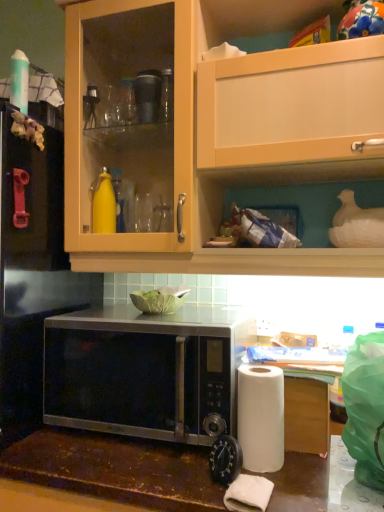
Find the location of a particular element. The width and height of the screenshot is (384, 512). white matte paper towel at lower right is located at coordinates (261, 417).

The width and height of the screenshot is (384, 512). What do you see at coordinates (144, 372) in the screenshot?
I see `black metallic microwave at center` at bounding box center [144, 372].

Where is `matte wood cabinet at upper center`? The width and height of the screenshot is (384, 512). matte wood cabinet at upper center is located at coordinates (217, 129).

Locate an element on the screen. This screenshot has height=512, width=384. white matte paper towel at lower right is located at coordinates (261, 417).

Looking at this image, is black metallic microwave at center positioned far away from matte wood cabinet at upper center?

Actually, black metallic microwave at center and matte wood cabinet at upper center are a little close together.

Find the location of a particular element. cabinetry above the black metallic microwave at center (from a real-world perspective) is located at coordinates (217, 129).

Who is taller, black metallic microwave at center or matte wood cabinet at upper center?

matte wood cabinet at upper center.

Is black matte microwave at lower center positioned with its back to black metallic microwave at center?

No, black matte microwave at lower center is not facing the opposite direction of black metallic microwave at center.

From a real-world perspective, is black matte microwave at lower center located higher than black metallic microwave at center?

Yes, from a real-world perspective, black matte microwave at lower center is on top of black metallic microwave at center.

Consider the image. Is black matte microwave at lower center taller than black metallic microwave at center?

Indeed, black matte microwave at lower center has a greater height compared to black metallic microwave at center.

Which object is further away from the camera, black matte microwave at lower center or black metallic microwave at center?

black matte microwave at lower center.

Between black metallic microwave at center and black matte microwave at lower center, which one has larger size?

Bigger between the two is black matte microwave at lower center.

Is black metallic microwave at center looking in the opposite direction of black matte microwave at lower center?

That's not correct — black metallic microwave at center is not looking away from black matte microwave at lower center.

Is black metallic microwave at center wider than black matte microwave at lower center?

In fact, black metallic microwave at center might be narrower than black matte microwave at lower center.

In order to click on microwave oven on the right side of black matte microwave at lower center in this screenshot , I will do `click(144, 372)`.

Based on the photo, is white matte paper towel at lower right a part of white paper at lower right?

No, white matte paper towel at lower right is not a part of white paper at lower right.

Can you tell me how much white paper at lower right and white matte paper towel at lower right differ in facing direction?

2.35 degrees.

Is white paper at lower right next to white matte paper towel at lower right and touching it?

white paper at lower right and white matte paper towel at lower right are not in contact.

Between point (279, 362) and point (255, 443), which one is positioned in front?

Point (255, 443)

Is black metallic microwave at center at the back of white paper at lower right?

That's not correct — white paper at lower right is not looking away from black metallic microwave at center.

From a real-world perspective, which object stands above the other?

black metallic microwave at center, from a real-world perspective.

Is white paper at lower right wider or thinner than black metallic microwave at center?

In the image, white paper at lower right appears to be more narrow than black metallic microwave at center.

Is white matte paper towel at lower right facing away from white paper at lower right?

Yes.

Is white paper at lower right inside white matte paper towel at lower right?

No, white paper at lower right is located outside of white matte paper towel at lower right.

Which of these two, white matte paper towel at lower right or white paper at lower right, is bigger?

With larger size is white paper at lower right.

From a real-world perspective, which is physically above, white matte paper towel at lower right or white paper at lower right?

white matte paper towel at lower right is physically above.

From the image's perspective, which object appears higher, black matte microwave at lower center or white matte paper towel at lower right?

black matte microwave at lower center appears higher in the image.

How different are the orientations of black matte microwave at lower center and white matte paper towel at lower right in degrees?

They differ by 3.8 degrees in their facing directions.

The height and width of the screenshot is (512, 384). In order to click on paper towel that appears below the black matte microwave at lower center (from a real-world perspective) in this screenshot , I will do `click(261, 417)`.

Between black matte microwave at lower center and white matte paper towel at lower right, which one has smaller width?

Answer: With smaller width is white matte paper towel at lower right.

In the image, there is a matte wood cabinet at upper center. At what (x,y) coordinates should I click in order to perform the action: click on microwave oven below it (from the image's perspective). Please return your answer as a coordinate pair (x, y). The height and width of the screenshot is (512, 384). Looking at the image, I should click on (144, 372).

Find the location of `appliance that is on the left side of black metallic microwave at center`. appliance that is on the left side of black metallic microwave at center is located at coordinates (32, 268).

Estimate the real-world distances between objects in this image. Which object is closer to white matte paper towel at lower right, matte wood cabinet at upper center or white paper at lower right?

white paper at lower right lies closer to white matte paper towel at lower right than the other object.

Considering their positions, is black matte microwave at lower center positioned closer to black metallic microwave at center than white matte paper towel at lower right?

Based on the image, white matte paper towel at lower right appears to be nearer to black metallic microwave at center.

Estimate the real-world distances between objects in this image. Which object is closer to black matte microwave at lower center, white paper at lower right or white matte paper towel at lower right?

The object closer to black matte microwave at lower center is white matte paper towel at lower right.

Considering their positions, is black metallic microwave at center positioned further to white matte paper towel at lower right than matte wood cabinet at upper center?

matte wood cabinet at upper center lies further to white matte paper towel at lower right than the other object.

Estimate the real-world distances between objects in this image. Which object is further from black metallic microwave at center, white paper at lower right or black matte microwave at lower center?

Based on the image, white paper at lower right appears to be further to black metallic microwave at center.

Looking at the image, which one is located closer to white paper at lower right, white matte paper towel at lower right or black metallic microwave at center?

white matte paper towel at lower right lies closer to white paper at lower right than the other object.

When comparing their distances from black metallic microwave at center, does black matte microwave at lower center or white paper at lower right seem closer?

black matte microwave at lower center is positioned closer to the anchor black metallic microwave at center.

Considering their positions, is white paper at lower right positioned closer to matte wood cabinet at upper center than black metallic microwave at center?

Based on the image, black metallic microwave at center appears to be nearer to matte wood cabinet at upper center.

Identify the location of cabinetry between black matte microwave at lower center and white matte paper towel at lower right in the horizontal direction. This screenshot has width=384, height=512. 217,129.

Where is `microwave oven between matte wood cabinet at upper center and white matte paper towel at lower right in the up-down direction`? microwave oven between matte wood cabinet at upper center and white matte paper towel at lower right in the up-down direction is located at coordinates (144, 372).

Image resolution: width=384 pixels, height=512 pixels. Identify the location of microwave oven between black matte microwave at lower center and matte wood cabinet at upper center from left to right. (144, 372).

At what (x,y) coordinates should I click in order to perform the action: click on paper towel between matte wood cabinet at upper center and white paper at lower right in the up-down direction. Please return your answer as a coordinate pair (x, y). The image size is (384, 512). Looking at the image, I should click on (261, 417).